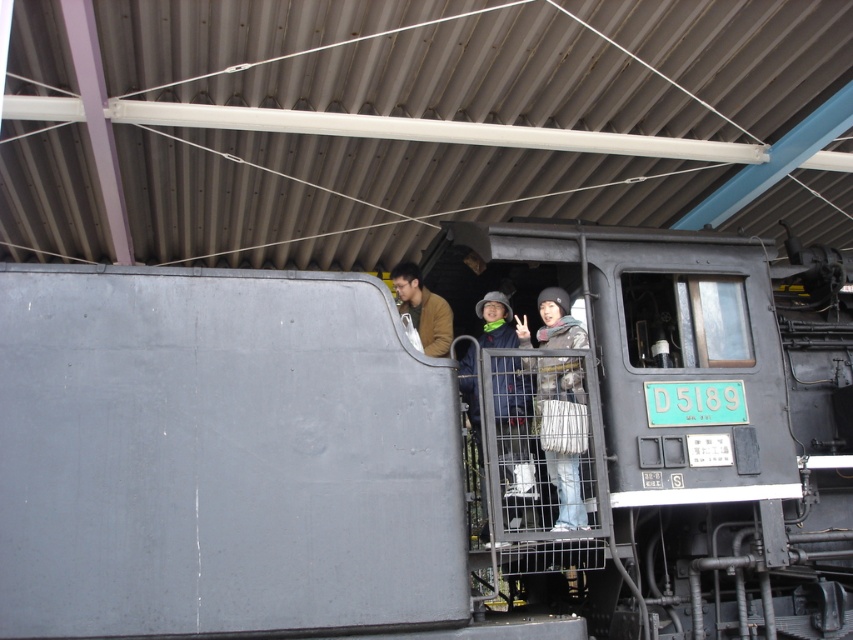
Question: Can you confirm if matte black train at center is thinner than brown matte jacket at center?

Choices:
 (A) yes
 (B) no

Answer: (B)

Question: Which of these objects is positioned closest to the matte gray jacket at center?

Choices:
 (A) matte black train at center
 (B) gray woolen hat at center

Answer: (B)

Question: Does matte black train at center have a smaller size compared to matte gray jacket at center?

Choices:
 (A) no
 (B) yes

Answer: (A)

Question: Does matte gray jacket at center appear under gray woolen hat at center?

Choices:
 (A) no
 (B) yes

Answer: (B)

Question: Which object appears closest to the camera in this image?

Choices:
 (A) brown matte jacket at center
 (B) gray woolen hat at center

Answer: (B)

Question: Considering the real-world distances, which object is closest to the brown matte jacket at center?

Choices:
 (A) gray woolen hat at center
 (B) matte gray jacket at center
 (C) matte black train at center

Answer: (B)